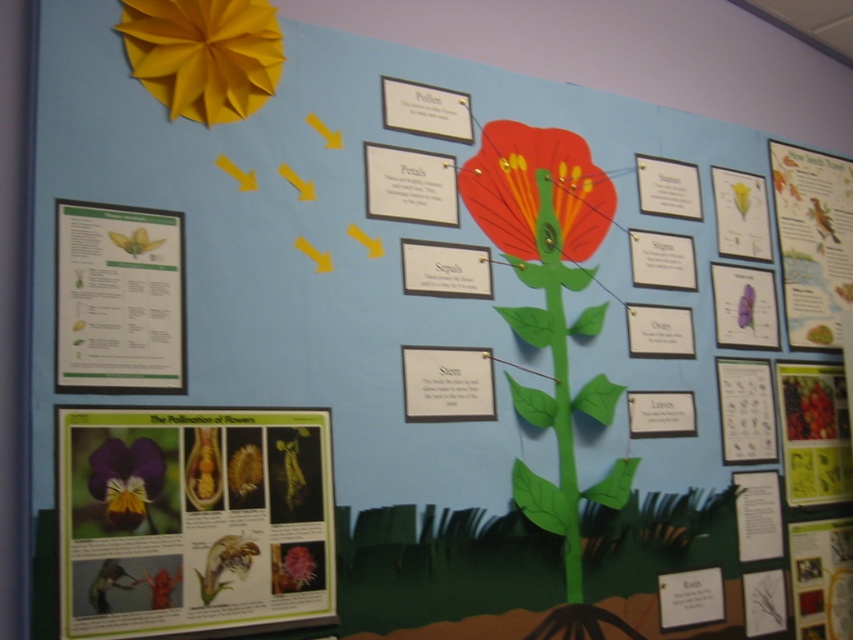
You are a student organizing the display board for a biology class. You have two flowers to place on the board. The matte yellow paper flower at upper left and the matte paper flower at center. Which flower has a smaller diameter?

The matte yellow paper flower at upper left is thinner than the matte paper flower at center, so the matte yellow paper flower at upper left has a smaller diameter.

You are a student trying to locate the green paper poster at lower left and the matte paper flower at center on the educational display board. Which object is positioned to the left of the other?

The green paper poster at lower left is to the left of the matte paper flower at center.